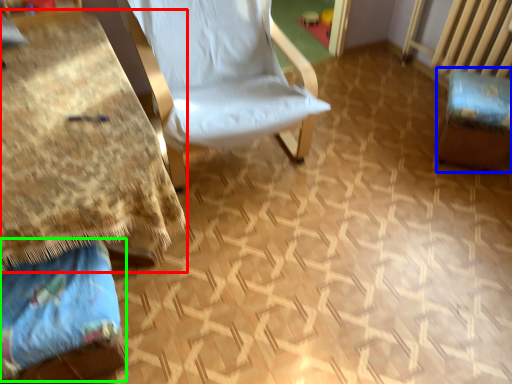
Question: Based on their relative distances, which object is farther from table (highlighted by a red box)? Choose from swivel chair (highlighted by a blue box) and fabric (highlighted by a green box).

Choices:
 (A) swivel chair
 (B) fabric

Answer: (A)